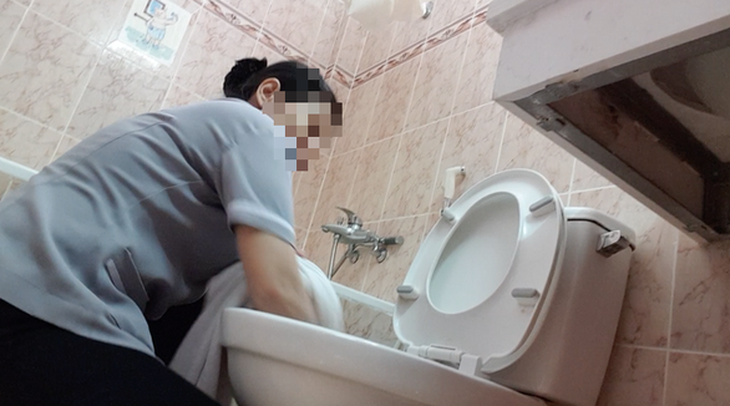
You are a GUI agent. You are given a task and a screenshot of the screen. Output one action in this format:
    pyautogui.click(x=<x>, y=<y>)
    Task: Click on the toilet seat
    This screenshot has height=406, width=730.
    Given the screenshot: What is the action you would take?
    pyautogui.click(x=520, y=263)